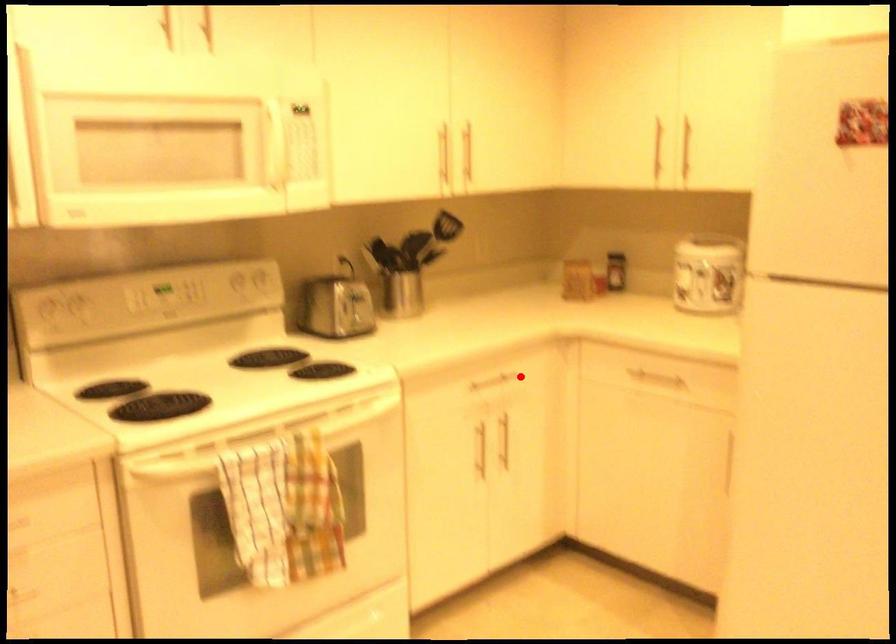
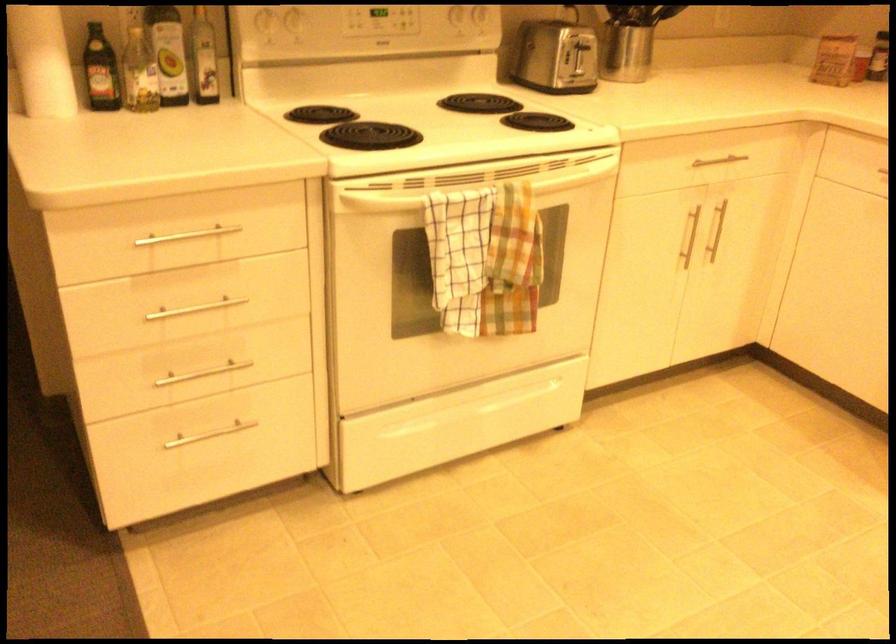
Question: I am providing you with two images of the same scene from different viewpoints. Image1 has a red point marked. In image2, the corresponding 3D location appears at what relative position? Reply with the corresponding letter.

Choices:
 (A) Closer
 (B) Farther

Answer: (A)